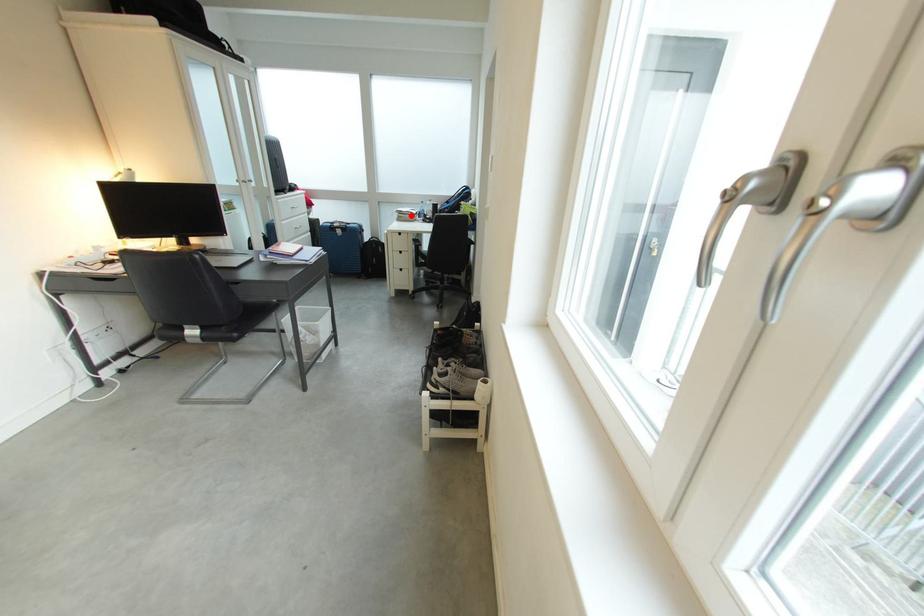
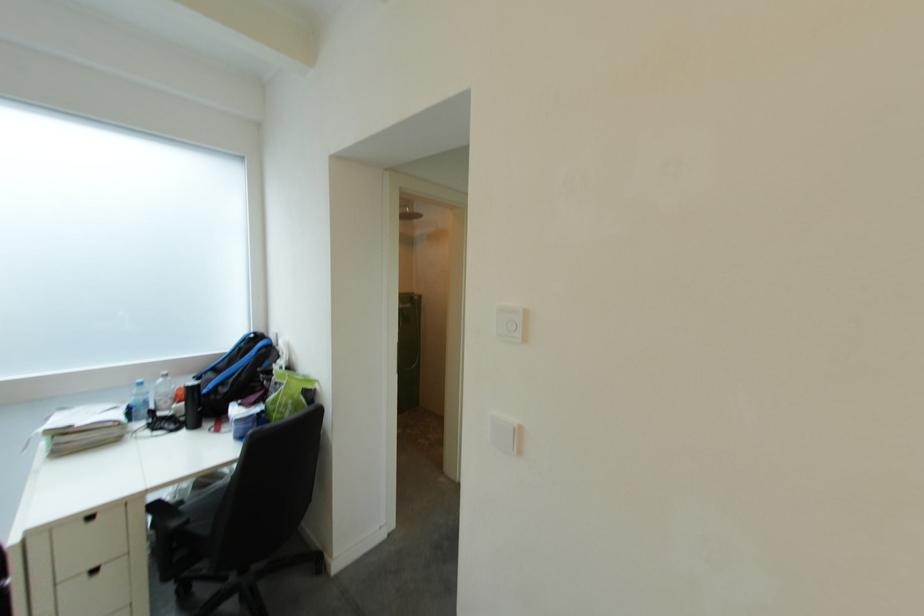
The point at the highlighted location is marked in the first image. Where is the corresponding point in the second image?

(73, 436)